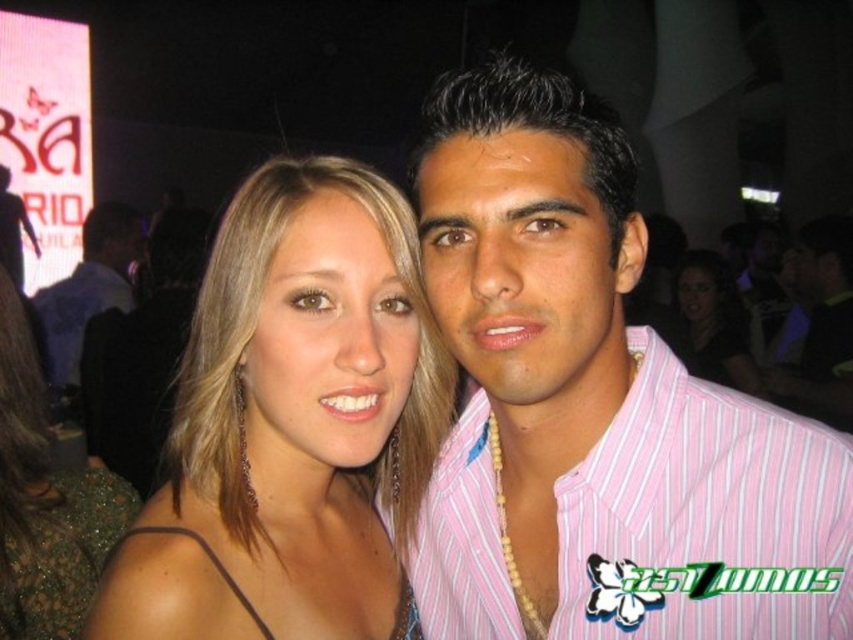
Question: Which object appears closest to the camera in this image?

Choices:
 (A) pink striped shirt at center
 (B) green sequined dress at lower left
 (C) shiny gold earrings at center
 (D) matte black hair at center

Answer: (A)

Question: Which object is positioned closest to the matte black hair at center?

Choices:
 (A) matte black shirt at center
 (B) shiny gold earrings at center

Answer: (A)

Question: Can you confirm if green sequined dress at lower left is bigger than matte black shirt at center?

Choices:
 (A) yes
 (B) no

Answer: (B)

Question: Can you confirm if shiny gold earrings at center is bigger than matte black shirt at center?

Choices:
 (A) yes
 (B) no

Answer: (B)

Question: Is matte black shirt at center thinner than matte black hair at center?

Choices:
 (A) yes
 (B) no

Answer: (B)

Question: Which point is farther to the camera?

Choices:
 (A) pink striped shirt at center
 (B) green sequined dress at lower left

Answer: (B)